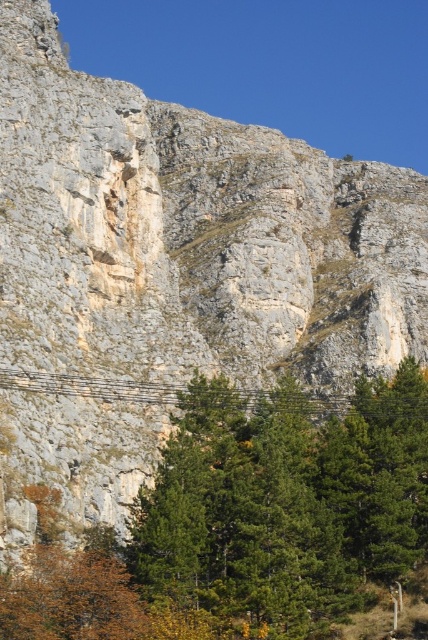
Does green leafy tree at center have a lesser width compared to metallic wire at center?

Yes, green leafy tree at center is thinner than metallic wire at center.

Between green leafy tree at center and metallic wire at center, which one has less height?

With less height is metallic wire at center.

Is point (181, 627) less distant than point (323, 406)?

That is True.

Identify the location of green leafy tree at center. The width and height of the screenshot is (428, 640). (250, 520).